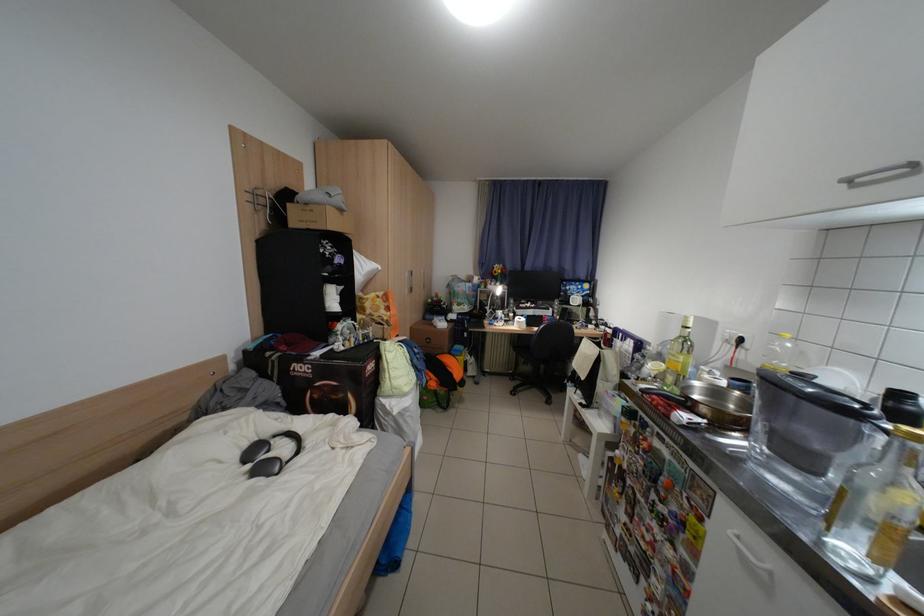
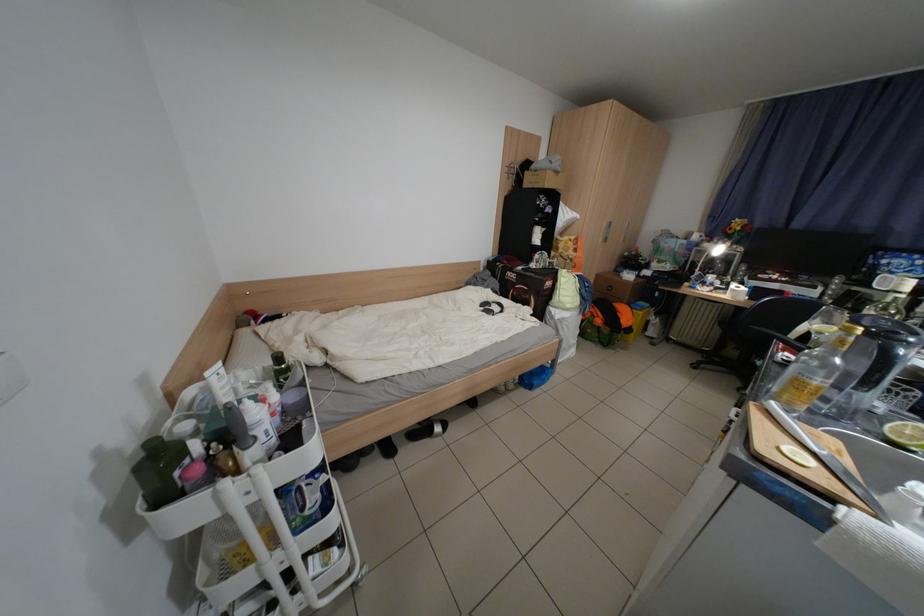
Question: The images are taken continuously from a first-person perspective. In which direction is your viewpoint rotating?

Choices:
 (A) Left
 (B) Right
 (C) Up
 (D) Down

Answer: (A)